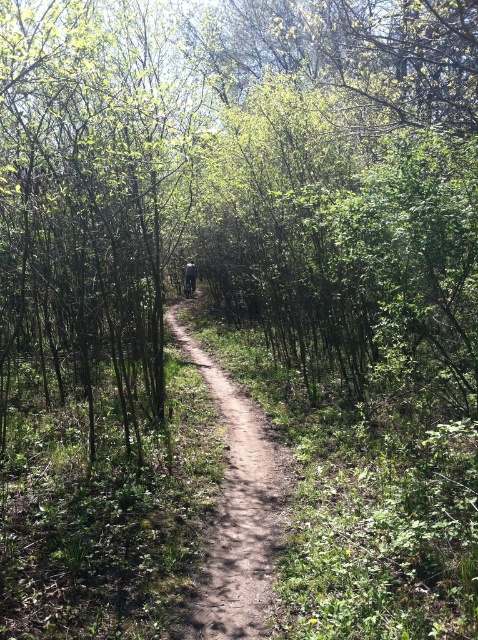
Can you confirm if dirt track at center is wider than dark gray fabric backpack at center?

Indeed, dirt track at center has a greater width compared to dark gray fabric backpack at center.

Can you confirm if dirt track at center is positioned below dark gray fabric backpack at center?

Answer: Correct, dirt track at center is located below dark gray fabric backpack at center.

Measure the distance between dirt track at center and camera.

dirt track at center is 3.36 meters away from camera.

At what (x,y) coordinates should I click in order to perform the action: click on dirt track at center. Please return your answer as a coordinate pair (x, y). The height and width of the screenshot is (640, 478). Looking at the image, I should click on (238, 513).